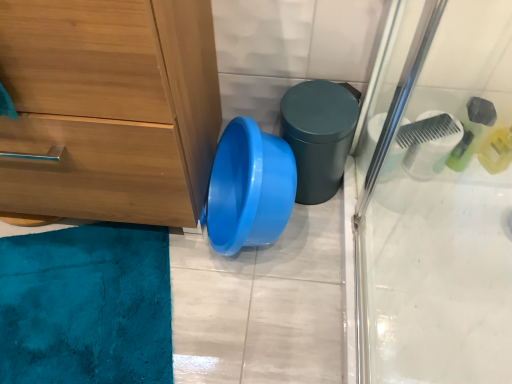
Question: Is wooden chest of drawers at left closer to the viewer compared to matte green potty at center?

Choices:
 (A) yes
 (B) no

Answer: (A)

Question: From the image's perspective, is wooden chest of drawers at left beneath matte green potty at center?

Choices:
 (A) yes
 (B) no

Answer: (B)

Question: Would you consider wooden chest of drawers at left to be distant from matte green potty at center?

Choices:
 (A) no
 (B) yes

Answer: (A)

Question: Is wooden chest of drawers at left next to matte green potty at center and touching it?

Choices:
 (A) no
 (B) yes

Answer: (A)

Question: Would you say wooden chest of drawers at left is outside matte green potty at center?

Choices:
 (A) no
 (B) yes

Answer: (B)

Question: Is wooden chest of drawers at left to the right of matte green potty at center from the viewer's perspective?

Choices:
 (A) no
 (B) yes

Answer: (A)

Question: Does matte green potty at center turn towards wooden chest of drawers at left?

Choices:
 (A) yes
 (B) no

Answer: (B)

Question: Is the position of matte green potty at center less distant than that of wooden chest of drawers at left?

Choices:
 (A) yes
 (B) no

Answer: (B)

Question: Is matte green potty at center shorter than wooden chest of drawers at left?

Choices:
 (A) yes
 (B) no

Answer: (A)

Question: Can you confirm if matte green potty at center is positioned to the left of wooden chest of drawers at left?

Choices:
 (A) no
 (B) yes

Answer: (A)

Question: Is matte green potty at center positioned behind wooden chest of drawers at left?

Choices:
 (A) no
 (B) yes

Answer: (B)

Question: Can you confirm if matte green potty at center is positioned to the right of wooden chest of drawers at left?

Choices:
 (A) yes
 (B) no

Answer: (A)

Question: Considering their positions, is wooden chest of drawers at left located in front of or behind matte green potty at center?

Choices:
 (A) front
 (B) behind

Answer: (A)